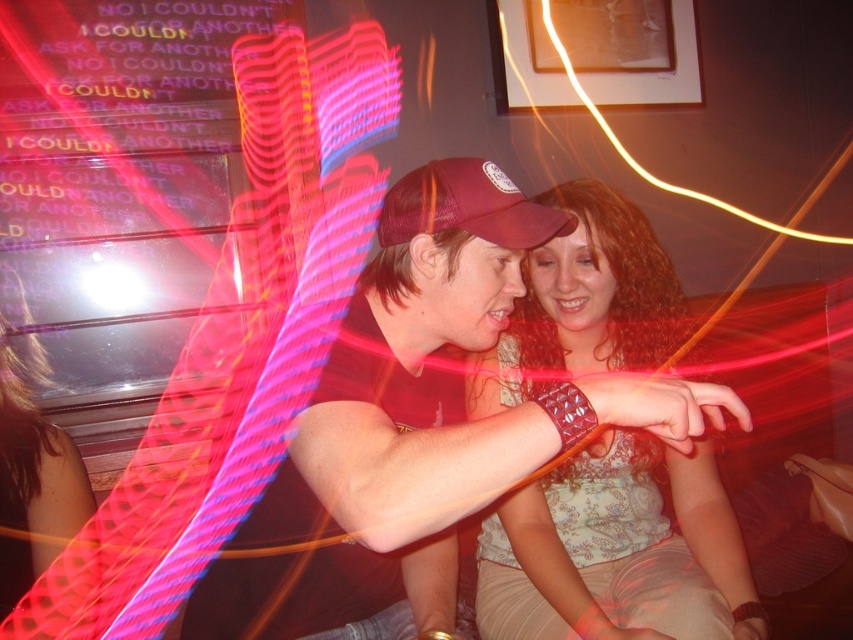
You are a photographer at the party and want to capture a closeup of the matte black dress at lower left and the maroon mesh baseball cap at center. Since your camera can only focus on one object at a time, which object should you choose to ensure the other is still in the frame?

The matte black dress at lower left has a lesser width compared to maroon mesh baseball cap at center. Therefore, you should focus on the maroon mesh baseball cap at center because its larger size will remain visible even if the dress is slightly out of focus.

You are standing at the entrance of the room and want to locate the light blue floral blouse at center. Based on the coordinates provided, where would you look to find it?

The light blue floral blouse at center is located at coordinates point (618, 552), meaning it is positioned near the lower right area of the image.

You are a photographer at a party and need to position two guests for a photo. The guests are wearing the light blue floral blouse at center and the matte black dress at lower left. If you want them to stand exactly 3 feet apart, should you move them closer or farther apart based on their current distance?

The light blue floral blouse at center is currently 31.43 inches from the matte black dress at lower left. Since 3 feet equals 36 inches, they need to move slightly farther apart to reach the desired distance.